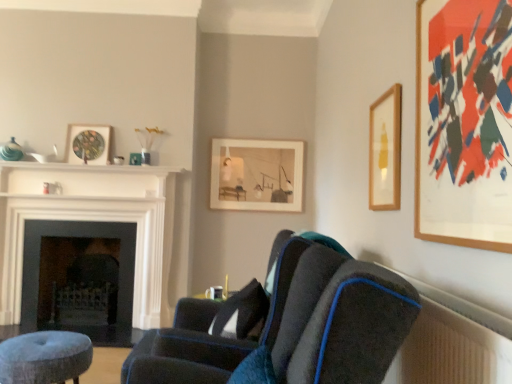
Locate an element on the screen. The image size is (512, 384). free point above velvet blue stool at lower left (from a real-world perspective) is located at coordinates (40, 337).